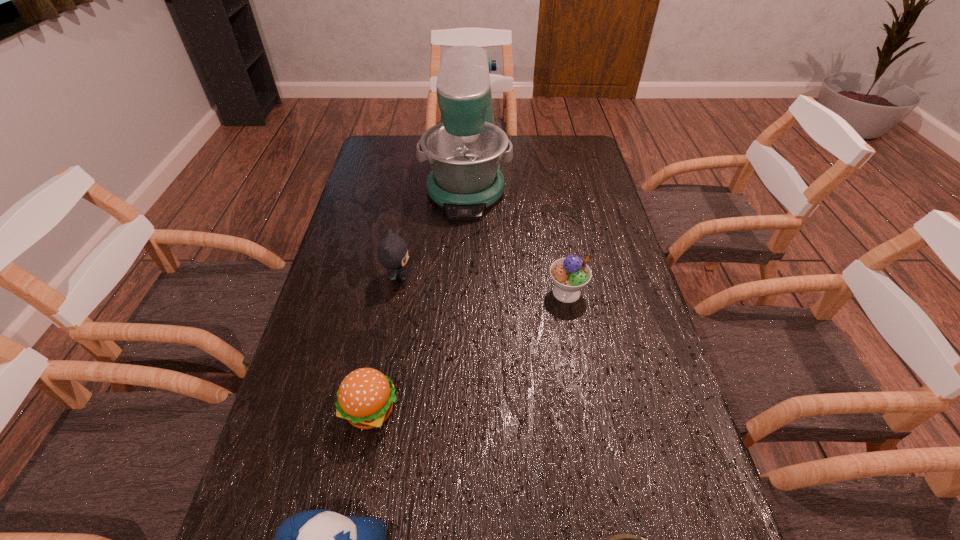
Find the location of `the farthest object`. the farthest object is located at coordinates (465, 149).

You are a GUI agent. You are given a task and a screenshot of the screen. Output one action in this format:
    pyautogui.click(x=<x>, y=<y>)
    Task: Click on the tallest object
    The width and height of the screenshot is (960, 540).
    Given the screenshot: What is the action you would take?
    pyautogui.click(x=465, y=149)

Where is `kitten`? This screenshot has height=540, width=960. kitten is located at coordinates (392, 252).

At what (x,y) coordinates should I click in order to perform the action: click on icecream. Please return your answer as a coordinate pair (x, y). The height and width of the screenshot is (540, 960). Looking at the image, I should click on (571, 274).

Where is `hamburger`? hamburger is located at coordinates (365, 397).

This screenshot has width=960, height=540. In order to click on vacant area situated 0.120m on the front-facing side of the tallest object in this screenshot , I will do `click(464, 246)`.

Locate an element on the screen. blank space located 0.140m on the front-facing side of the kitten is located at coordinates (461, 277).

This screenshot has height=540, width=960. Find the location of `free space located 0.290m on the back of the icecream`. free space located 0.290m on the back of the icecream is located at coordinates (552, 215).

You are a GUI agent. You are given a task and a screenshot of the screen. Output one action in this format:
    pyautogui.click(x=<x>, y=<y>)
    Task: Click on the vacant space located 0.380m on the right of the third nearest object
    The height and width of the screenshot is (540, 960).
    Given the screenshot: What is the action you would take?
    (572, 410)

Locate an element on the screen. The height and width of the screenshot is (540, 960). object that is at the far edge is located at coordinates (465, 149).